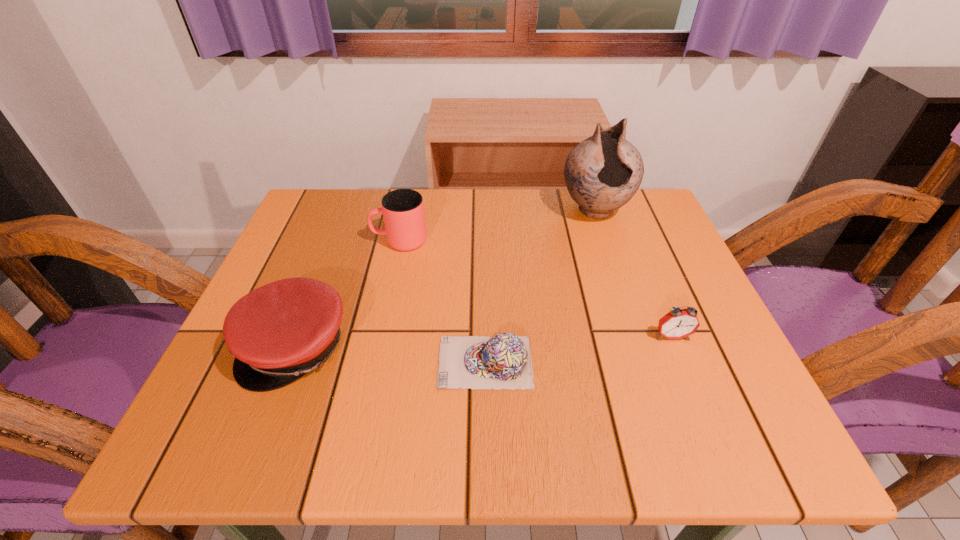
The image size is (960, 540). In the image, there is a desktop. Identify the location of vacant space at the near edge. (361, 437).

Where is `vacant space at the right edge of the desktop`? vacant space at the right edge of the desktop is located at coordinates (637, 307).

The height and width of the screenshot is (540, 960). In the image, there is a desktop. In order to click on free space at the far left corner in this screenshot , I will do `click(325, 196)`.

This screenshot has height=540, width=960. In the image, there is a desktop. What are the coordinates of `free space at the far right corner` in the screenshot? It's located at tap(610, 224).

The height and width of the screenshot is (540, 960). In the image, there is a desktop. In order to click on vacant space at the near right corner in this screenshot , I will do `click(719, 420)`.

This screenshot has height=540, width=960. In order to click on empty location between the left cap and the shortest object in this screenshot , I will do `click(391, 354)`.

Locate an element on the screen. The height and width of the screenshot is (540, 960). empty location between the alarm clock and the pottery is located at coordinates (634, 273).

Find the location of a particular element. vacant area that lies between the right cap and the second tallest object is located at coordinates (443, 302).

I want to click on free space between the right cap and the alarm clock, so point(579,349).

Where is `vacant area that lies between the shorter cap and the fourth shortest object`? vacant area that lies between the shorter cap and the fourth shortest object is located at coordinates (443, 302).